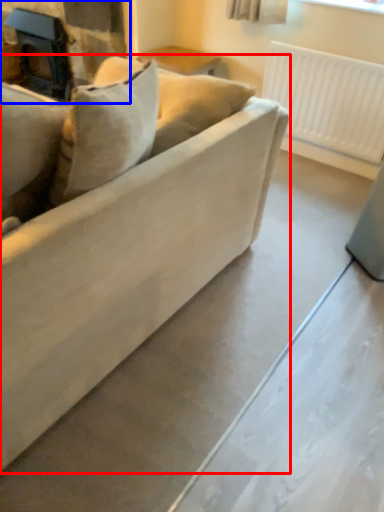
Question: Which point is further to the camera, studio couch (highlighted by a red box) or fireplace (highlighted by a blue box)?

Choices:
 (A) studio couch
 (B) fireplace

Answer: (B)